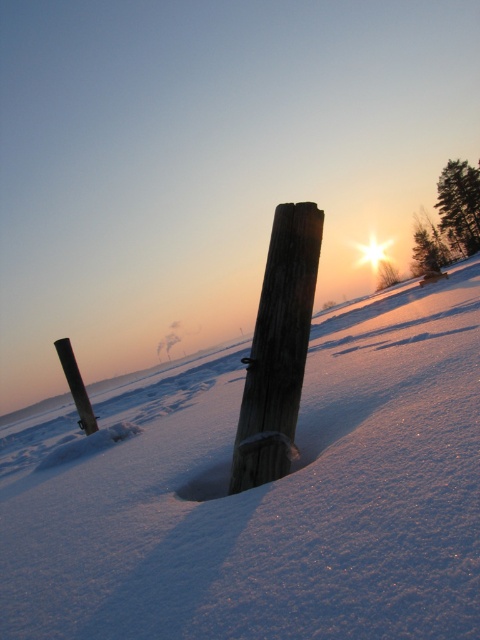
You are an observer standing at the top of a snowy hill. You see the white powdery snow at center and the black wood post at lower left. Which object is closer to you?

The white powdery snow at center is closer to you because it is positioned over the black wood post at lower left, indicating it is in a higher or more forward position.